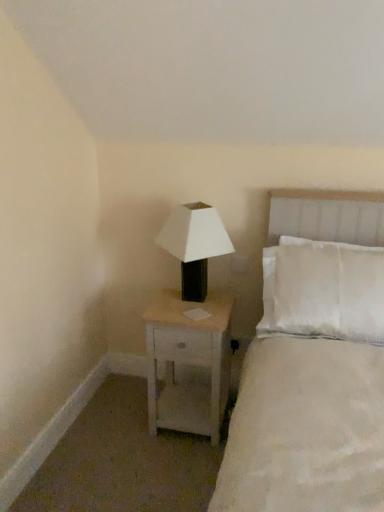
The width and height of the screenshot is (384, 512). I want to click on white soft bed at upper right, so click(x=299, y=426).

Find the location of a particular element. This screenshot has height=512, width=384. white matte/black plastic lamp at upper right is located at coordinates (194, 245).

Looking at this image, is white matte/black plastic lamp at upper right located within white wood nightstand at center?

No, white matte/black plastic lamp at upper right is located outside of white wood nightstand at center.

Considering the positions of point (183, 339) and point (218, 229), is point (183, 339) closer or farther from the camera than point (218, 229)?

Clearly, point (183, 339) is closer to the camera than point (218, 229).

Considering the relative positions of white wood nightstand at center and white matte/black plastic lamp at upper right in the image provided, is white wood nightstand at center behind white matte/black plastic lamp at upper right?

Yes, white wood nightstand at center is behind white matte/black plastic lamp at upper right.

From the image's perspective, between white wood nightstand at center and white matte/black plastic lamp at upper right, who is located below?

white wood nightstand at center is shown below in the image.

Is point (194, 289) closer or farther from the camera than point (152, 418)?

Point (194, 289) appears to be closer to the viewer than point (152, 418).

From the image's perspective, which object appears higher, white matte/black plastic lamp at upper right or white wood nightstand at center?

A: white matte/black plastic lamp at upper right, from the image's perspective.

Is white matte/black plastic lamp at upper right far from white wood nightstand at center?

No, white matte/black plastic lamp at upper right is not far away from white wood nightstand at center.

Is white matte/black plastic lamp at upper right bigger than white wood nightstand at center?

No.

Can you confirm if white soft bed at upper right is positioned to the left of white wood nightstand at center?

No, white soft bed at upper right is not to the left of white wood nightstand at center.

How different are the orientations of white soft bed at upper right and white wood nightstand at center in degrees?

The angular difference between white soft bed at upper right and white wood nightstand at center is 0.00114 degrees.

Is white wood nightstand at center a part of white soft bed at upper right?

No, white soft bed at upper right does not contain white wood nightstand at center.

Identify the location of bed positioned vertically above the white wood nightstand at center (from a real-world perspective). Image resolution: width=384 pixels, height=512 pixels. (299, 426).

Is white wood nightstand at center placed right next to white soft bed at upper right?

white wood nightstand at center and white soft bed at upper right are not in contact.

Who is shorter, white wood nightstand at center or white soft bed at upper right?

Standing shorter between the two is white wood nightstand at center.

Between white wood nightstand at center and white soft bed at upper right, which one has smaller size?

white wood nightstand at center is smaller.

The width and height of the screenshot is (384, 512). I want to click on bed that appears in front of the white wood nightstand at center, so click(x=299, y=426).

Are white matte/black plastic lamp at upper right and white soft bed at upper right beside each other?

white matte/black plastic lamp at upper right and white soft bed at upper right are not in contact.

Does white matte/black plastic lamp at upper right turn towards white soft bed at upper right?

No.

From a real-world perspective, is white matte/black plastic lamp at upper right positioned over white soft bed at upper right based on gravity?

Yes, from a real-world perspective, white matte/black plastic lamp at upper right is above white soft bed at upper right.

Identify the location of bed below the white matte/black plastic lamp at upper right (from the image's perspective). This screenshot has width=384, height=512. (299, 426).

Identify the location of lamp above the white soft bed at upper right (from the image's perspective). pyautogui.click(x=194, y=245).

Between white soft bed at upper right and white matte/black plastic lamp at upper right, which one has more height?

With more height is white soft bed at upper right.

From a real-world perspective, between white soft bed at upper right and white matte/black plastic lamp at upper right, who is vertically higher?

white matte/black plastic lamp at upper right is physically above.

Between white soft bed at upper right and white matte/black plastic lamp at upper right, which one has larger size?

Bigger between the two is white soft bed at upper right.

The image size is (384, 512). In order to click on lamp lying on the right of white wood nightstand at center in this screenshot , I will do `click(194, 245)`.

Where is `nightstand below the white matte/black plastic lamp at upper right (from the image's perspective)`? This screenshot has width=384, height=512. nightstand below the white matte/black plastic lamp at upper right (from the image's perspective) is located at coordinates [189, 362].

Considering their positions, is white soft bed at upper right positioned further to white matte/black plastic lamp at upper right than white wood nightstand at center?

Among the two, white soft bed at upper right is located further to white matte/black plastic lamp at upper right.

Consider the image. Based on their spatial positions, is white matte/black plastic lamp at upper right or white soft bed at upper right further from white wood nightstand at center?

Among the two, white soft bed at upper right is located further to white wood nightstand at center.

Based on the photo, which object lies nearer to the anchor point white matte/black plastic lamp at upper right, white wood nightstand at center or white soft bed at upper right?

The object closer to white matte/black plastic lamp at upper right is white wood nightstand at center.

In the scene shown: Based on their spatial positions, is white wood nightstand at center or white matte/black plastic lamp at upper right further from white soft bed at upper right?

white matte/black plastic lamp at upper right.

Looking at the image, which one is located closer to white wood nightstand at center, white soft bed at upper right or white matte/black plastic lamp at upper right?

Based on the image, white matte/black plastic lamp at upper right appears to be nearer to white wood nightstand at center.

When comparing their distances from white soft bed at upper right, does white matte/black plastic lamp at upper right or white wood nightstand at center seem further?

white matte/black plastic lamp at upper right lies further to white soft bed at upper right than the other object.

You are a GUI agent. You are given a task and a screenshot of the screen. Output one action in this format:
    pyautogui.click(x=<x>, y=<y>)
    Task: Click on the lamp located between white wood nightstand at center and white soft bed at upper right in the left-right direction
    This screenshot has height=512, width=384.
    Given the screenshot: What is the action you would take?
    pyautogui.click(x=194, y=245)